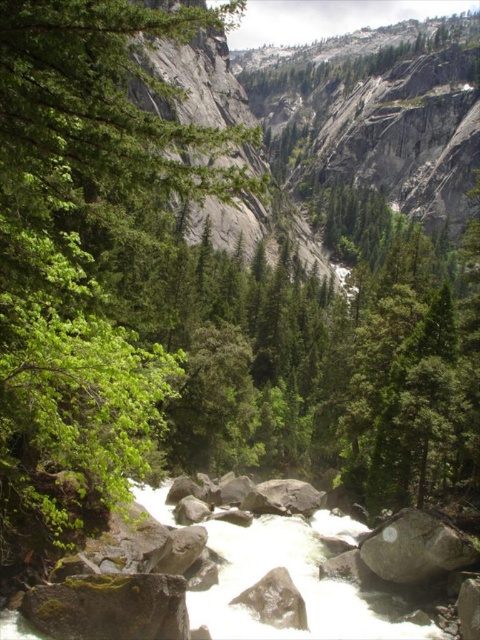
Is the position of mossy rock at lower left more distant than that of gray rough boulder at center?

No, mossy rock at lower left is closer to the viewer.

How far apart are mossy rock at lower left and gray rough boulder at center?

They are 21.67 meters apart.

Who is more distant from viewer, (145,625) or (469,544)?

Point (469,544)

Identify the location of mossy rock at lower left. (108, 608).

Which of these two, green leafy tree at left or gray rough boulder at center, stands taller?

Standing taller between the two is green leafy tree at left.

Who is lower down, green leafy tree at left or gray rough boulder at center?

gray rough boulder at center

Where is `green leafy tree at left`? This screenshot has width=480, height=640. green leafy tree at left is located at coordinates (84, 253).

Is green leafy tree at left above mossy rock at lower left?

Indeed, green leafy tree at left is positioned over mossy rock at lower left.

Which of these two, green leafy tree at left or mossy rock at lower left, stands shorter?

mossy rock at lower left is shorter.

Locate an element on the screen. green leafy tree at left is located at coordinates (84, 253).

Image resolution: width=480 pixels, height=640 pixels. Find the location of `green leafy tree at left`. green leafy tree at left is located at coordinates (84, 253).